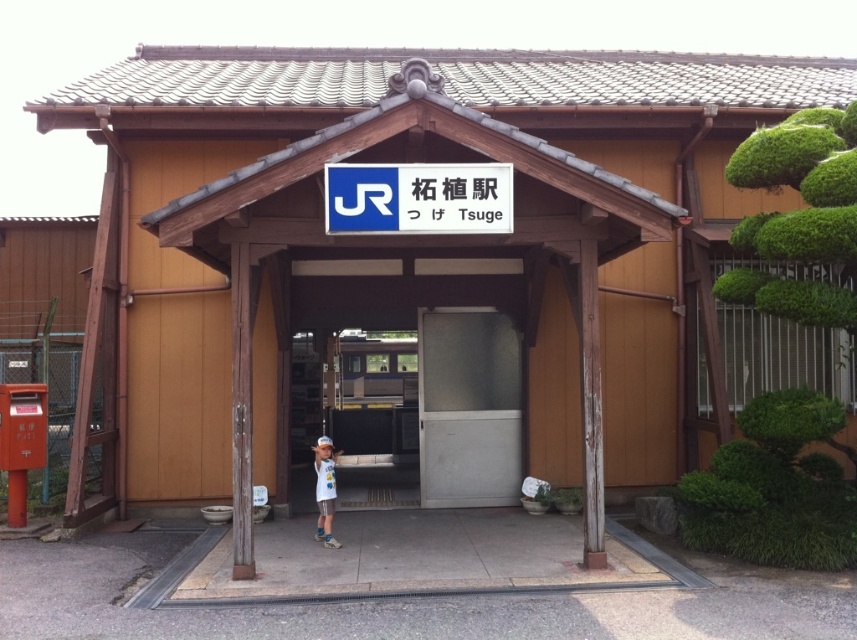
Question: Which point is farther from the camera taking this photo?

Choices:
 (A) (321, 504)
 (B) (369, 182)

Answer: (A)

Question: Where is blue plastic sign at center located in relation to white cotton shirt at center in the image?

Choices:
 (A) below
 (B) above

Answer: (B)

Question: Does white matte door at center have a lesser width compared to blue plastic sign at center?

Choices:
 (A) yes
 (B) no

Answer: (A)

Question: Which of the following is the closest to the observer?

Choices:
 (A) (464, 362)
 (B) (325, 545)
 (C) (322, 192)

Answer: (C)

Question: Does white matte door at center appear over blue plastic sign at center?

Choices:
 (A) yes
 (B) no

Answer: (B)

Question: Which point is farther to the camera?

Choices:
 (A) (423, 324)
 (B) (327, 499)
 (C) (426, 179)

Answer: (A)